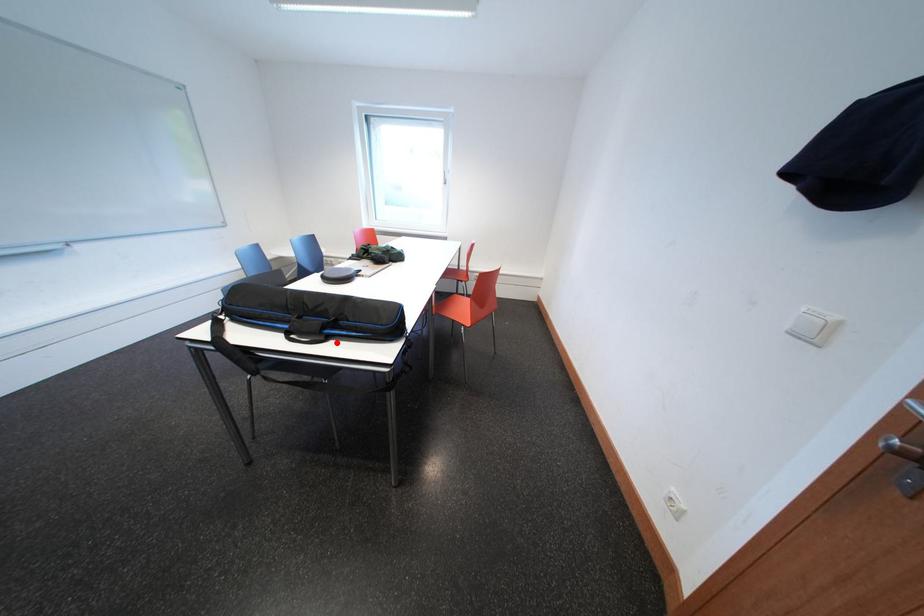
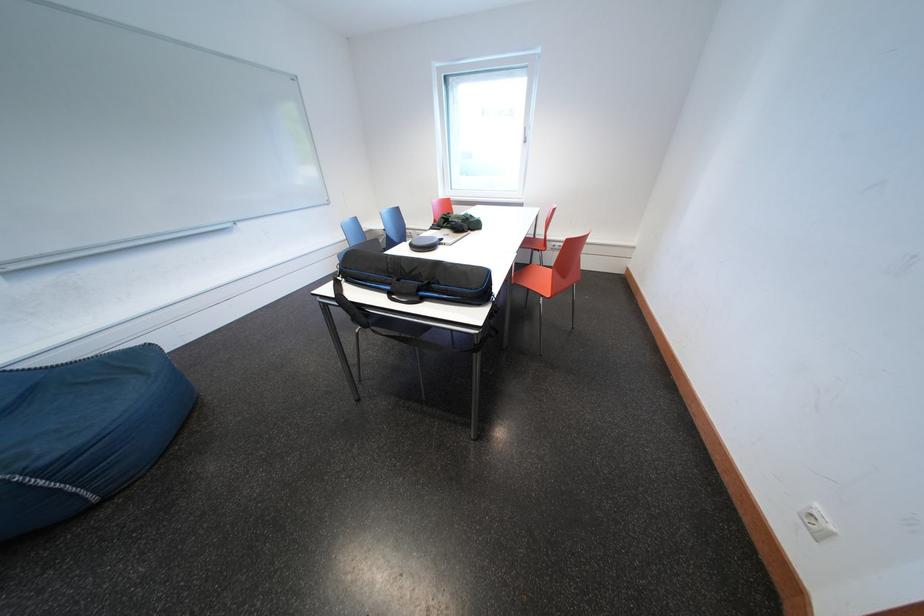
Where in the second image is the point corresponding to the highlighted location from the first image?

(431, 304)